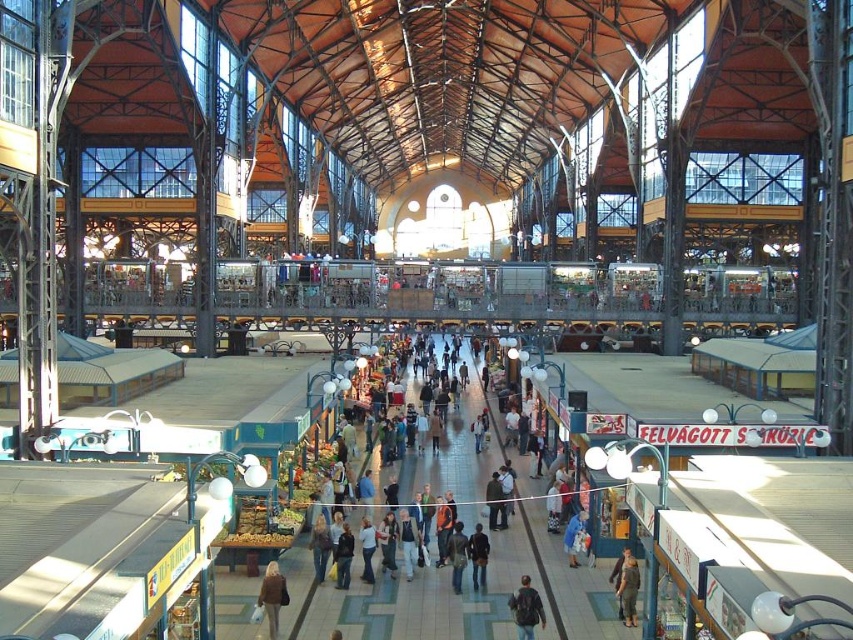
Question: Can you confirm if brown leather jacket at center is positioned to the right of dark brown leather jacket at center?

Choices:
 (A) no
 (B) yes

Answer: (A)

Question: Estimate the real-world distances between objects in this image. Which object is closer to the dark brown leather jacket at center?

Choices:
 (A) dark brown leather backpack at center
 (B) brown leather jacket at center
 (C) brown fabric pants at center

Answer: (A)

Question: Is brown fabric pants at center behind dark brown leather jacket at center?

Choices:
 (A) yes
 (B) no

Answer: (B)

Question: Which point is farther to the camera?

Choices:
 (A) (485, 580)
 (B) (257, 604)
 (C) (531, 580)

Answer: (A)

Question: Which of the following is the closest to the observer?

Choices:
 (A) dark brown leather jacket at center
 (B) brown leather jacket at center
 (C) dark brown leather backpack at center
 (D) brown fabric pants at center

Answer: (C)

Question: Does dark brown leather backpack at center have a smaller size compared to dark brown leather jacket at center?

Choices:
 (A) no
 (B) yes

Answer: (B)